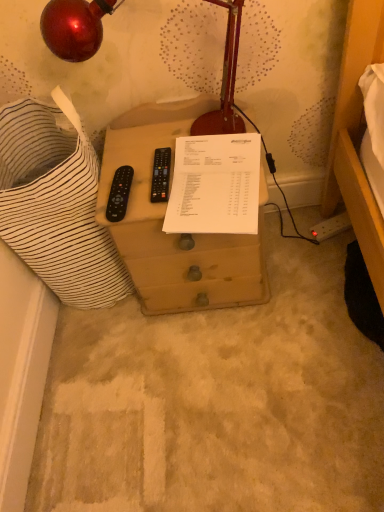
At what (x,y) coordinates should I click in order to perform the action: click on vacant area that lies to the right of brown wooden drawer at center. Please return your answer as a coordinate pair (x, y). Image resolution: width=384 pixels, height=512 pixels. Looking at the image, I should click on (298, 257).